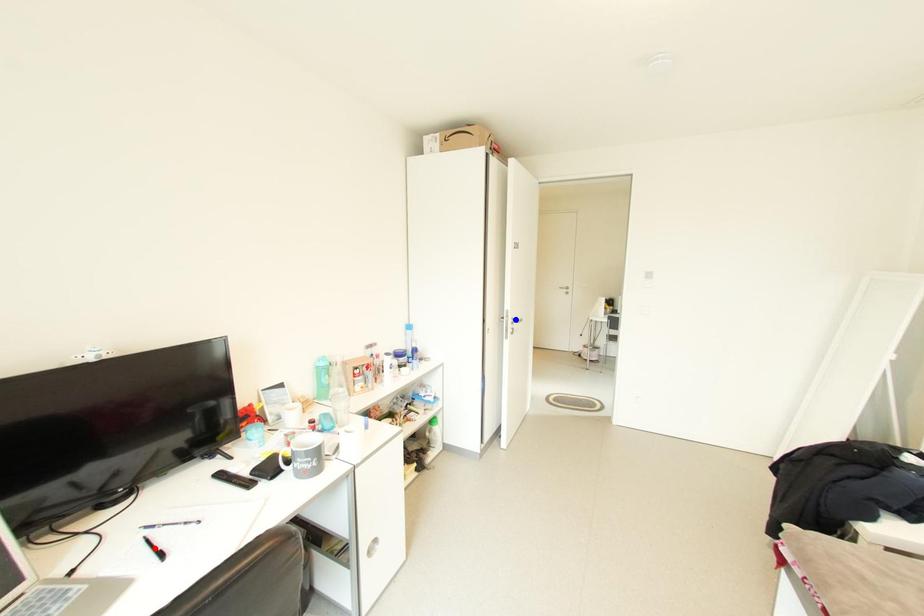
Question: Which of the two points in the image is closer to the camera?

Choices:
 (A) Blue point is closer.
 (B) Red point is closer.

Answer: (B)